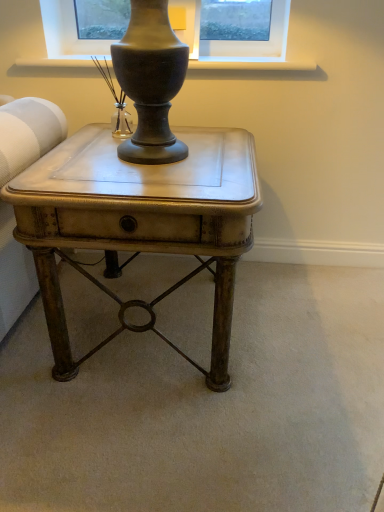
Describe the element at coordinates (139, 223) in the screenshot. I see `matte brown side table at center` at that location.

You are a GUI agent. You are given a task and a screenshot of the screen. Output one action in this format:
    pyautogui.click(x=<x>, y=<y>)
    Task: Click on the matte brown side table at center
    Image resolution: width=384 pixels, height=512 pixels.
    Given the screenshot: What is the action you would take?
    pyautogui.click(x=139, y=223)

Locate an element on the screen. matte wood window sill at upper center is located at coordinates (253, 65).

This screenshot has height=512, width=384. What do you see at coordinates (253, 65) in the screenshot? I see `matte wood window sill at upper center` at bounding box center [253, 65].

The height and width of the screenshot is (512, 384). I want to click on matte brown side table at center, so click(139, 223).

Would you say matte wood window sill at upper center is to the left or to the right of matte brown side table at center in the picture?

matte wood window sill at upper center is positioned on matte brown side table at center's right side.

Relative to matte brown side table at center, is matte wood window sill at upper center in front or behind?

Visually, matte wood window sill at upper center is located behind matte brown side table at center.

Which is less distant, (199, 65) or (166, 221)?

The point (166, 221) is closer to the camera.

From the image's perspective, relative to matte brown side table at center, is matte wood window sill at upper center above or below?

Clearly, from the image's perspective, matte wood window sill at upper center is above matte brown side table at center.

From a real-world perspective, between matte wood window sill at upper center and matte brown side table at center, who is vertically higher?

In real-world perspective, matte wood window sill at upper center is above.

Is matte wood window sill at upper center wider or thinner than matte brown side table at center?

In the image, matte wood window sill at upper center appears to be more narrow than matte brown side table at center.

Considering the sizes of objects matte wood window sill at upper center and matte brown side table at center in the image provided, who is shorter, matte wood window sill at upper center or matte brown side table at center?

With less height is matte wood window sill at upper center.

Is matte wood window sill at upper center bigger than matte brown side table at center?

Actually, matte wood window sill at upper center might be smaller than matte brown side table at center.

From the picture: Is matte wood window sill at upper center outside of matte brown side table at center?

Yes, matte wood window sill at upper center is not within matte brown side table at center.

Is matte wood window sill at upper center placed right next to matte brown side table at center?

They are not placed beside each other.

Is matte wood window sill at upper center oriented away from matte brown side table at center?

That's not correct — matte wood window sill at upper center is not looking away from matte brown side table at center.

How different are the orientations of matte wood window sill at upper center and matte brown side table at center in degrees?

matte wood window sill at upper center and matte brown side table at center are facing 1.17 degrees away from each other.

How distant is matte wood window sill at upper center from matte brown side table at center?

The distance of matte wood window sill at upper center from matte brown side table at center is 28.58 inches.

Identify the location of window sill lying behind the matte brown side table at center. (253, 65).

Does matte brown side table at center appear on the left side of matte wood window sill at upper center?

Indeed, matte brown side table at center is positioned on the left side of matte wood window sill at upper center.

Between matte brown side table at center and matte wood window sill at upper center, which one is positioned in front?

matte brown side table at center.

Does point (247, 233) come closer to viewer compared to point (263, 68)?

That is True.

From the image's perspective, is matte brown side table at center positioned above or below matte wood window sill at upper center?

From the image's perspective, matte brown side table at center appears below matte wood window sill at upper center.

From a real-world perspective, does matte brown side table at center sit lower than matte wood window sill at upper center?

Correct, in the physical world, matte brown side table at center is lower than matte wood window sill at upper center.

Considering the relative sizes of matte brown side table at center and matte wood window sill at upper center in the image provided, is matte brown side table at center thinner than matte wood window sill at upper center?

No.

Considering the relative sizes of matte brown side table at center and matte wood window sill at upper center in the image provided, is matte brown side table at center shorter than matte wood window sill at upper center?

No, matte brown side table at center is not shorter than matte wood window sill at upper center.

Is matte brown side table at center bigger than matte wood window sill at upper center?

Yes.

Is matte brown side table at center outside of matte wood window sill at upper center?

Absolutely, matte brown side table at center is external to matte wood window sill at upper center.

Looking at this image, would you say matte brown side table at center is a long distance from matte wood window sill at upper center?

No, matte brown side table at center is in close proximity to matte wood window sill at upper center.

Is matte brown side table at center aimed at matte wood window sill at upper center?

No, matte brown side table at center is not facing towards matte wood window sill at upper center.

Measure the distance between matte brown side table at center and matte wood window sill at upper center.

matte brown side table at center is 72.61 centimeters away from matte wood window sill at upper center.

Locate an element on the screen. The height and width of the screenshot is (512, 384). table below the matte wood window sill at upper center (from the image's perspective) is located at coordinates (139, 223).

Find the location of a particular element. table below the matte wood window sill at upper center (from a real-world perspective) is located at coordinates (139, 223).

You are a GUI agent. You are given a task and a screenshot of the screen. Output one action in this format:
    pyautogui.click(x=<x>, y=<y>)
    Task: Click on the window sill above the matte brown side table at center (from the image's perspective)
    Image resolution: width=384 pixels, height=512 pixels.
    Given the screenshot: What is the action you would take?
    pyautogui.click(x=253, y=65)